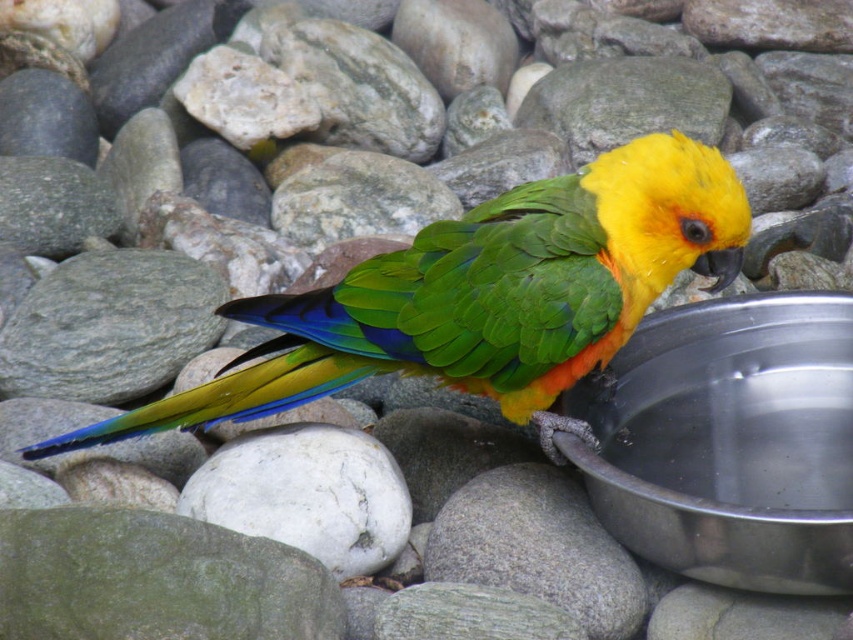
Consider the image. You are a birdwatcher trying to set up a camera to capture the shiny green parrot at center. The camera is placed near the metallic silver basin at lower right. Considering the possible width of the parrot and basin, could the parrot be wider than the basin?

The shiny green parrot at center might be wider than metallic silver basin at lower right, so there is a possibility that the parrot is wider than the basin.

You are a photographer setting up a shot of the shiny green parrot at center and the metallic silver basin at lower right. To ensure both subjects are in frame, which direction should you position your camera relative to the basin?

You should position your camera to the left of the metallic silver basin at lower right because the shiny green parrot at center is on the left side of the basin.